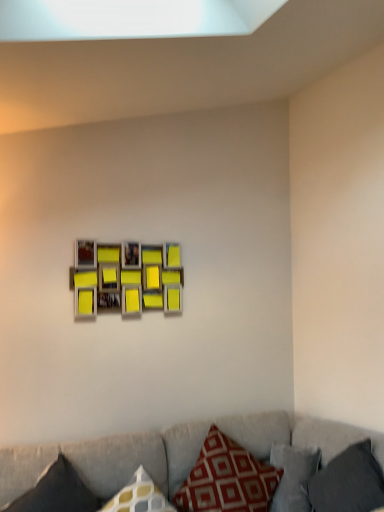
Measure the distance between textured gray couch at lower center and camera.

textured gray couch at lower center and camera are 1.75 meters apart.

What do you see at coordinates (109, 460) in the screenshot?
I see `textured gray couch at lower center` at bounding box center [109, 460].

I want to click on red printed cushion at lower center, the 2th pillow from the left, so click(x=227, y=479).

The height and width of the screenshot is (512, 384). I want to click on pillow that is the 2nd one when counting leftward from the dark gray fabric pillow at lower right, the 1th pillow in the right-to-left sequence, so click(57, 492).

Based on the photo, is dark gray fabric pillow at lower right, arranged as the third pillow when viewed from the left, in front of or behind dark gray fabric pillow at lower left, the first pillow when ordered from left to right, in the image?

dark gray fabric pillow at lower right, arranged as the third pillow when viewed from the left, is positioned farther from the viewer than dark gray fabric pillow at lower left, the first pillow when ordered from left to right.

Considering the points (323, 469) and (25, 495), which point is in front, point (323, 469) or point (25, 495)?

The point (25, 495) is closer to the camera.

Which point is more forward, (91,505) or (86,310)?

The point (91,505) is more forward.

From the image's perspective, who appears lower, dark gray fabric pillow at lower left, the 3th pillow positioned from the right, or matte yellow picture frame at center?

dark gray fabric pillow at lower left, the 3th pillow positioned from the right, from the image's perspective.

Relative to matte yellow picture frame at center, is dark gray fabric pillow at lower left, the first pillow when ordered from left to right, in front or behind?

Visually, dark gray fabric pillow at lower left, the first pillow when ordered from left to right, is located in front of matte yellow picture frame at center.

From a real-world perspective, is dark gray fabric pillow at lower right, arranged as the third pillow when viewed from the left, located beneath red printed cushion at lower center, the 2th pillow from the left?

Actually, dark gray fabric pillow at lower right, arranged as the third pillow when viewed from the left, is physically above red printed cushion at lower center, the 2th pillow from the left, in the real world.

Does dark gray fabric pillow at lower right, the 1th pillow in the right-to-left sequence, have a lesser height compared to red printed cushion at lower center, the 2th pillow from the left?

Correct, dark gray fabric pillow at lower right, the 1th pillow in the right-to-left sequence, is not as tall as red printed cushion at lower center, the 2th pillow from the left.

Is point (377, 477) farther from camera compared to point (206, 476)?

No, it is in front of (206, 476).

Is dark gray fabric pillow at lower left, the first pillow when ordered from left to right, in front of or behind dark gray fabric pillow at lower right, the 1th pillow in the right-to-left sequence, in the image?

dark gray fabric pillow at lower left, the first pillow when ordered from left to right, is positioned closer to the viewer than dark gray fabric pillow at lower right, the 1th pillow in the right-to-left sequence.

In the scene shown: Considering the positions of objects dark gray fabric pillow at lower left, the first pillow when ordered from left to right, and dark gray fabric pillow at lower right, arranged as the third pillow when viewed from the left, in the image provided, who is more to the right, dark gray fabric pillow at lower left, the first pillow when ordered from left to right, or dark gray fabric pillow at lower right, arranged as the third pillow when viewed from the left,?

dark gray fabric pillow at lower right, arranged as the third pillow when viewed from the left, is more to the right.

From the image's perspective, is dark gray fabric pillow at lower left, the 3th pillow positioned from the right, above or below dark gray fabric pillow at lower right, the 1th pillow in the right-to-left sequence?

Clearly, from the image's perspective, dark gray fabric pillow at lower left, the 3th pillow positioned from the right, is above dark gray fabric pillow at lower right, the 1th pillow in the right-to-left sequence.

Between point (157, 266) and point (183, 510), which one is positioned in front?

Positioned in front is point (183, 510).

Is matte yellow picture frame at center thinner than red printed cushion at lower center, placed as the second pillow when sorted from right to left?

Yes, matte yellow picture frame at center is thinner than red printed cushion at lower center, placed as the second pillow when sorted from right to left.

Which is correct: matte yellow picture frame at center is inside red printed cushion at lower center, the 2th pillow from the left, or outside of it?

matte yellow picture frame at center is located beyond the bounds of red printed cushion at lower center, the 2th pillow from the left.

From the picture: Does matte yellow picture frame at center touch red printed cushion at lower center, placed as the second pillow when sorted from right to left?

matte yellow picture frame at center is not next to red printed cushion at lower center, placed as the second pillow when sorted from right to left, and they're not touching.

Who is taller, textured gray couch at lower center or dark gray fabric pillow at lower right, the 1th pillow in the right-to-left sequence?

textured gray couch at lower center.

Which object is wider, textured gray couch at lower center or dark gray fabric pillow at lower right, the 1th pillow in the right-to-left sequence?

textured gray couch at lower center.

Which object is closer to the camera taking this photo, textured gray couch at lower center or dark gray fabric pillow at lower right, arranged as the third pillow when viewed from the left?

textured gray couch at lower center is closer to the camera.

Considering the points (190, 439) and (363, 509), which point is in front, point (190, 439) or point (363, 509)?

Positioned in front is point (363, 509).

Can matte yellow picture frame at center be found inside textured gray couch at lower center?

No, matte yellow picture frame at center is not inside textured gray couch at lower center.

Is textured gray couch at lower center in contact with matte yellow picture frame at center?

No, textured gray couch at lower center is not making contact with matte yellow picture frame at center.

From the image's perspective, relative to matte yellow picture frame at center, is textured gray couch at lower center above or below?

From the image's perspective, textured gray couch at lower center appears below matte yellow picture frame at center.

From a real-world perspective, is textured gray couch at lower center located beneath matte yellow picture frame at center?

Indeed, from a real-world perspective, textured gray couch at lower center is positioned beneath matte yellow picture frame at center.

Locate an element on the screen. the 1st pillow directly beneath the dark gray fabric pillow at lower left, the 3th pillow positioned from the right (from a real-world perspective) is located at coordinates (349, 482).

Locate an element on the screen. the 3rd pillow in front of the matte yellow picture frame at center is located at coordinates (57, 492).

Which object lies further to the anchor point dark gray fabric pillow at lower right, arranged as the third pillow when viewed from the left, red printed cushion at lower center, placed as the second pillow when sorted from right to left, or matte yellow picture frame at center?

matte yellow picture frame at center is further to dark gray fabric pillow at lower right, arranged as the third pillow when viewed from the left.

Based on the photo, looking at the image, which one is located closer to red printed cushion at lower center, placed as the second pillow when sorted from right to left, dark gray fabric pillow at lower right, arranged as the third pillow when viewed from the left, or matte yellow picture frame at center?

Based on the image, dark gray fabric pillow at lower right, arranged as the third pillow when viewed from the left, appears to be nearer to red printed cushion at lower center, placed as the second pillow when sorted from right to left.

Estimate the real-world distances between objects in this image. Which object is closer to textured gray couch at lower center, matte yellow picture frame at center or red printed cushion at lower center, placed as the second pillow when sorted from right to left?

Among the two, red printed cushion at lower center, placed as the second pillow when sorted from right to left, is located nearer to textured gray couch at lower center.

Considering their positions, is dark gray fabric pillow at lower right, arranged as the third pillow when viewed from the left, positioned closer to textured gray couch at lower center than dark gray fabric pillow at lower left, the first pillow when ordered from left to right?

dark gray fabric pillow at lower left, the first pillow when ordered from left to right, is closer to textured gray couch at lower center.

Looking at the image, which one is located closer to dark gray fabric pillow at lower left, the 3th pillow positioned from the right, textured gray couch at lower center or matte yellow picture frame at center?

Based on the image, textured gray couch at lower center appears to be nearer to dark gray fabric pillow at lower left, the 3th pillow positioned from the right.

Estimate the real-world distances between objects in this image. Which object is closer to red printed cushion at lower center, the 2th pillow from the left, textured gray couch at lower center or dark gray fabric pillow at lower left, the 3th pillow positioned from the right?

The object closer to red printed cushion at lower center, the 2th pillow from the left, is textured gray couch at lower center.

Looking at the image, which one is located closer to matte yellow picture frame at center, textured gray couch at lower center or dark gray fabric pillow at lower right, arranged as the third pillow when viewed from the left?

textured gray couch at lower center.

From the image, which object appears to be nearer to textured gray couch at lower center, matte yellow picture frame at center or dark gray fabric pillow at lower right, the 1th pillow in the right-to-left sequence?

dark gray fabric pillow at lower right, the 1th pillow in the right-to-left sequence, is closer to textured gray couch at lower center.

What are the coordinates of `picture frame situated between dark gray fabric pillow at lower left, the first pillow when ordered from left to right, and dark gray fabric pillow at lower right, arranged as the third pillow when viewed from the left, from left to right` in the screenshot? It's located at (126, 278).

Locate an element on the screen. pillow between dark gray fabric pillow at lower left, the 3th pillow positioned from the right, and dark gray fabric pillow at lower right, arranged as the third pillow when viewed from the left, in the horizontal direction is located at coordinates coord(227,479).

I want to click on studio couch between dark gray fabric pillow at lower left, the first pillow when ordered from left to right, and dark gray fabric pillow at lower right, the 1th pillow in the right-to-left sequence, so click(x=109, y=460).